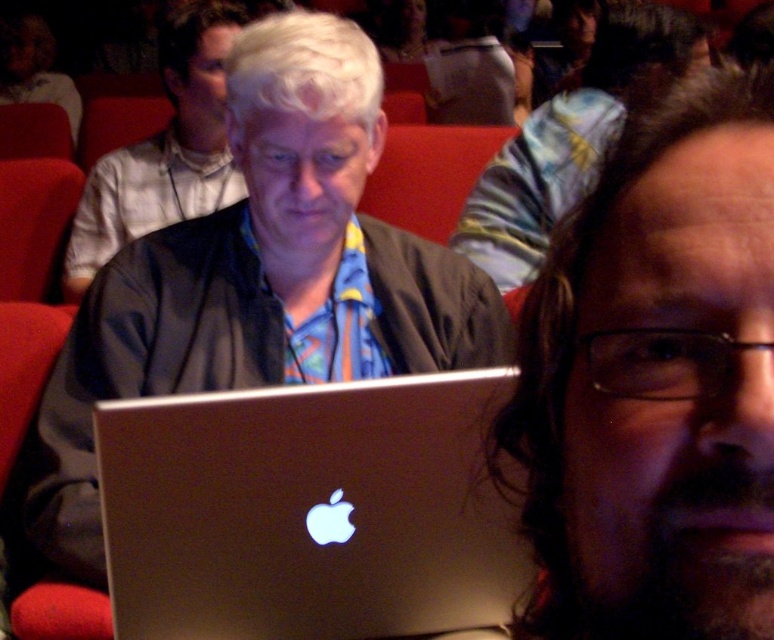
Question: Considering the relative positions of silver metallic laptop at center and blue patterned scarf at center in the image provided, where is silver metallic laptop at center located with respect to blue patterned scarf at center?

Choices:
 (A) right
 (B) left

Answer: (A)

Question: Which point is closer to the camera?

Choices:
 (A) (521, 166)
 (B) (180, 189)
 (C) (170, 632)
 (D) (663, 348)

Answer: (D)

Question: Is matte black laptop at center to the right of striped shirt at center from the viewer's perspective?

Choices:
 (A) yes
 (B) no

Answer: (B)

Question: Where is dark brown hair at center located in relation to blue patterned scarf at center in the image?

Choices:
 (A) right
 (B) left

Answer: (A)

Question: Among these points, which one is nearest to the camera?

Choices:
 (A) (217, 344)
 (B) (245, 20)
 (C) (563, 621)
 (D) (433, 499)

Answer: (C)

Question: Which point appears closest to the camera in this image?

Choices:
 (A) (230, 35)
 (B) (555, 403)

Answer: (B)